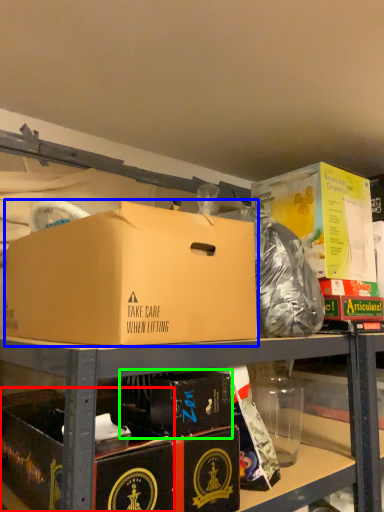
Question: Estimate the real-world distances between objects in this image. Which object is farther from box (highlighted by a red box), box (highlighted by a blue box) or box (highlighted by a green box)?

Choices:
 (A) box
 (B) box

Answer: (A)